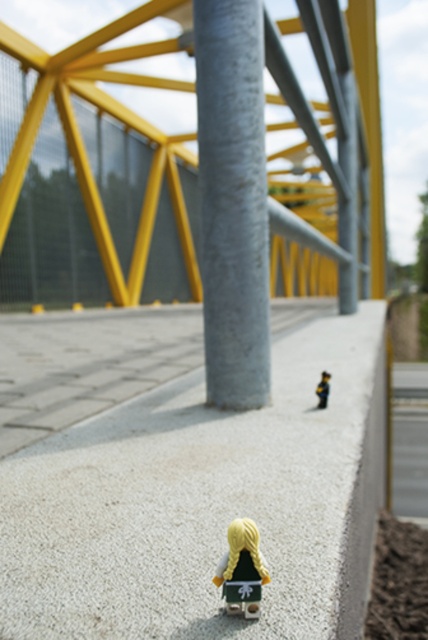
You are a photographer setting up a shot of the yellow metallic bridge at upper center and the gray concrete curb at right. Which object should you focus on first if you want to capture both in a single frame without moving the camera?

The yellow metallic bridge at upper center is bigger than the gray concrete curb at right, so you should focus on the yellow metallic bridge at upper center first to ensure it fills the frame appropriately before adjusting for the smaller curb.

Based on the photo, you are a photographer setting up a shot of the two figurines on the white textured concrete at center and the matte yellow hair at lower center. Which object is directly below the other?

The white textured concrete at center is positioned under matte yellow hair at lower center, so the matte yellow hair at lower center is directly above the white textured concrete at center.

You are a delivery drone with a 1.5 meter wingspan. You need to fly between the white textured concrete at center and the matte yellow hair at lower center. Can you fit through the space between them without touching either?

The distance between the white textured concrete at center and the matte yellow hair at lower center is 1.43 meters. Since your wingspan is 1.5 meters, you cannot fit through the space as it is slightly narrower than your wingspan.